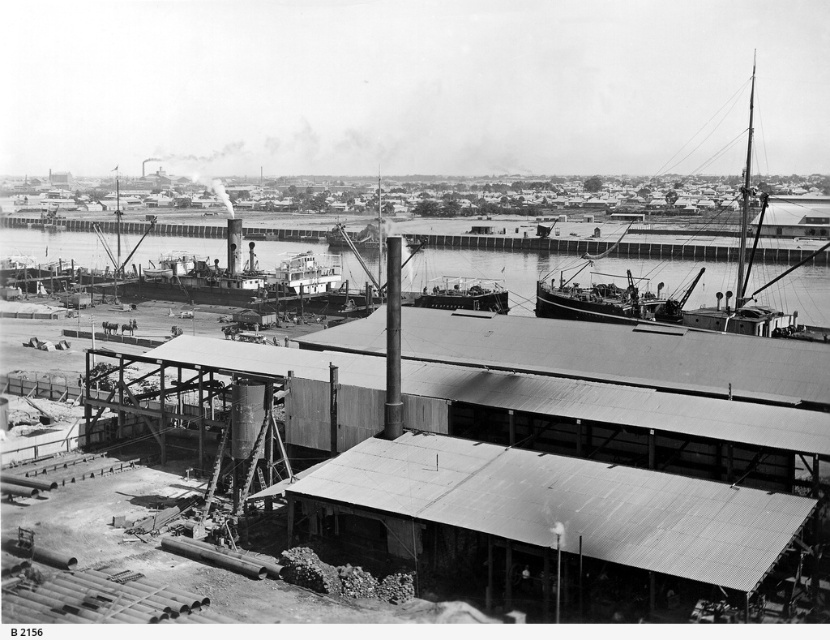
Question: Which of the following is the closest to the observer?

Choices:
 (A) rusty metal ship at right
 (B) smooth metal boat at center

Answer: (A)

Question: Can you confirm if rusty metal ship at right is positioned to the right of smooth metal boat at center?

Choices:
 (A) yes
 (B) no

Answer: (A)

Question: Is rusty metal ship at right bigger than smooth metal boat at center?

Choices:
 (A) yes
 (B) no

Answer: (A)

Question: Does rusty metal ship at right come behind smooth metal boat at center?

Choices:
 (A) no
 (B) yes

Answer: (A)